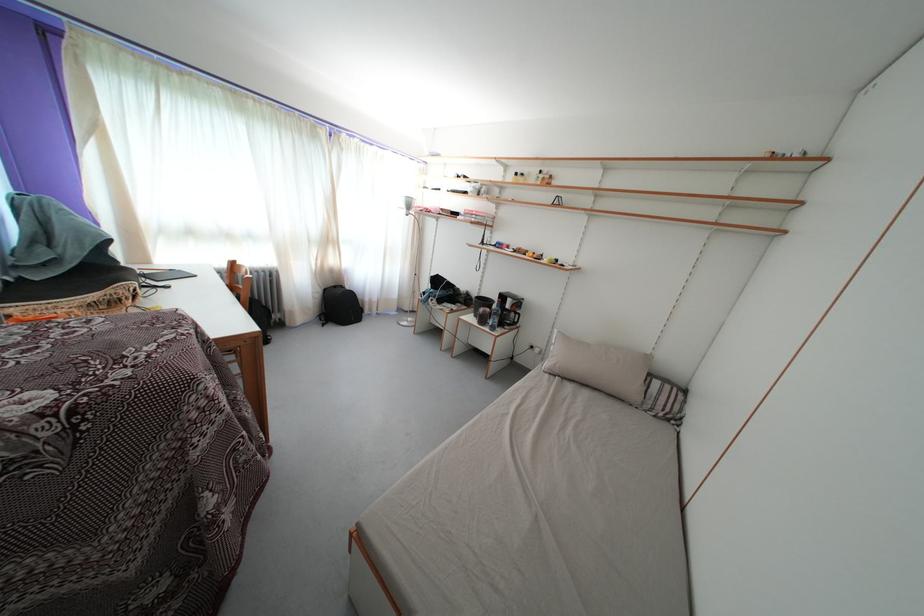
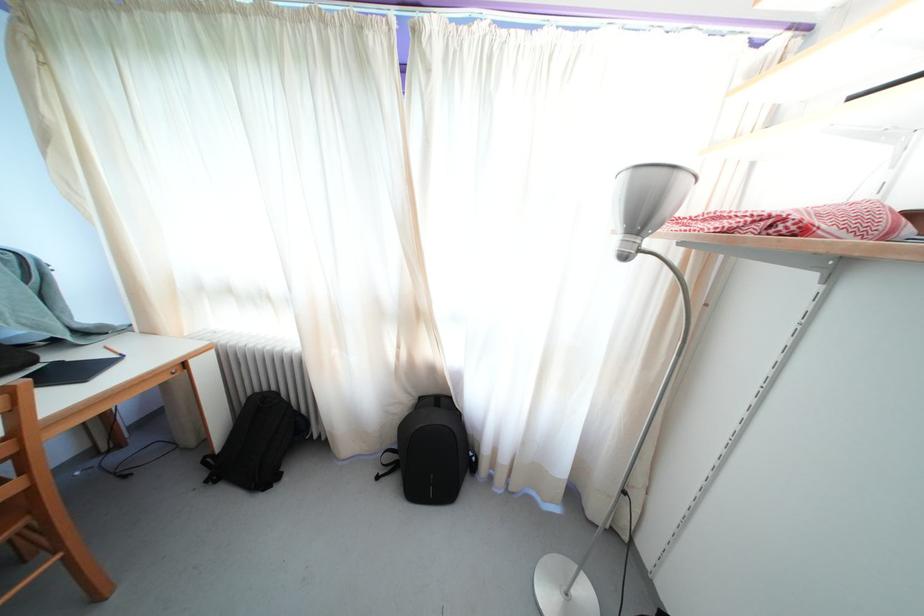
Where in the second image is the point corresponding to pixel 335 246 from the first image?

(421, 321)